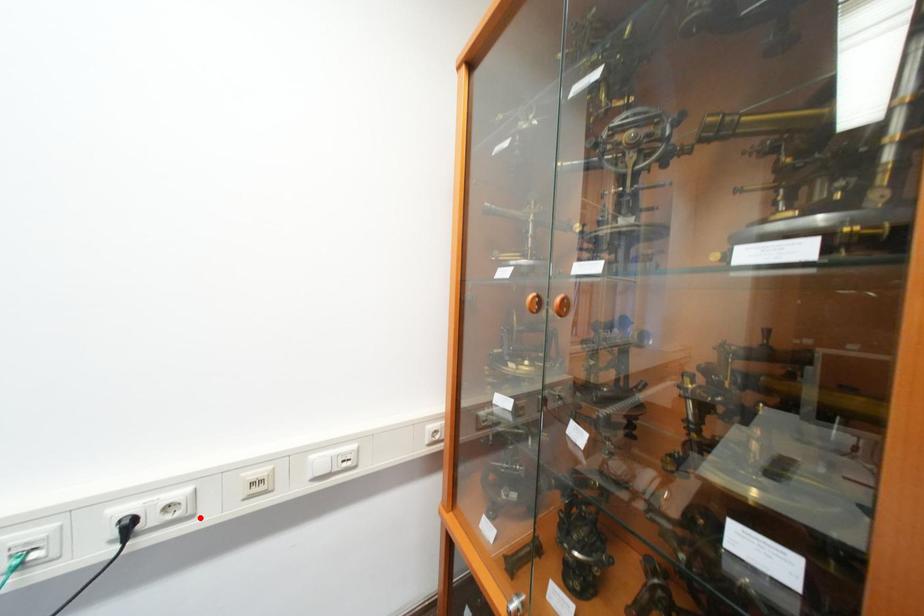
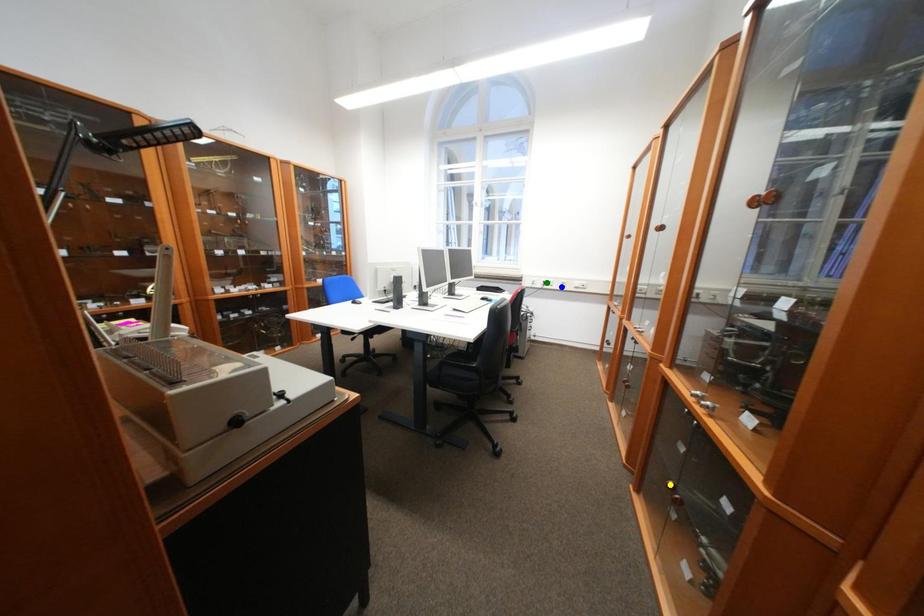
Question: I am providing you with two images of the same scene from different viewpoints. A red point is marked on the first image. You are given multiple points on the second image. Which mark in image 2 goes with the point in image 1?

Choices:
 (A) green point
 (B) blue point
 (C) yellow point

Answer: (B)